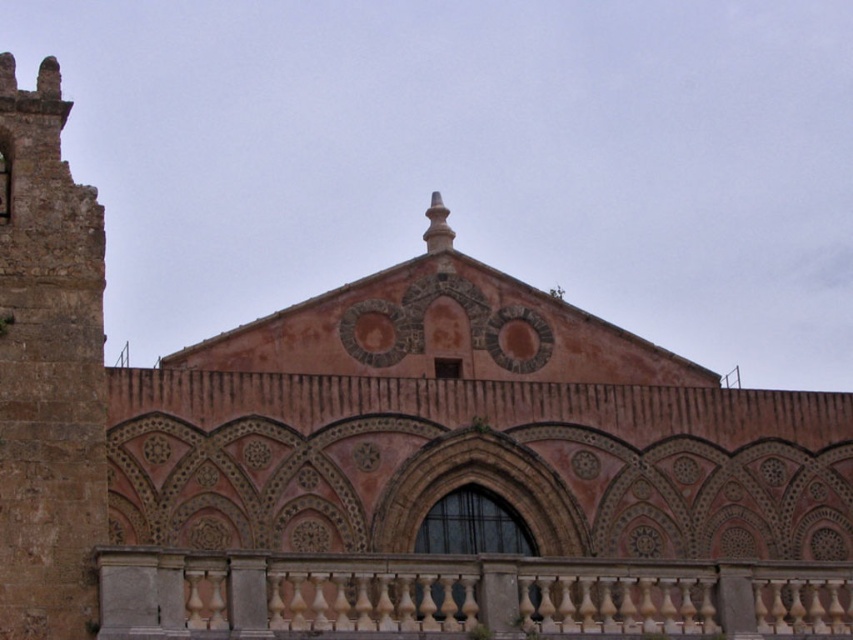
Does beige marble balustrade at lower center appear over rustic stone tower at left?

No, beige marble balustrade at lower center is not above rustic stone tower at left.

Can you confirm if beige marble balustrade at lower center is taller than rustic stone tower at left?

No.

Is point (410, 604) positioned before point (47, 241)?

Yes, it is.

In order to click on beige marble balustrade at lower center in this screenshot , I will do tap(460, 596).